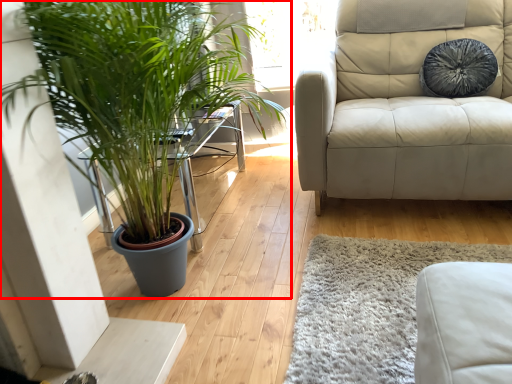
Question: From the image's perspective, considering the relative positions of houseplant (annotated by the red box) and pillow in the image provided, where is houseplant (annotated by the red box) located with respect to the staircase?

Choices:
 (A) below
 (B) above

Answer: (A)